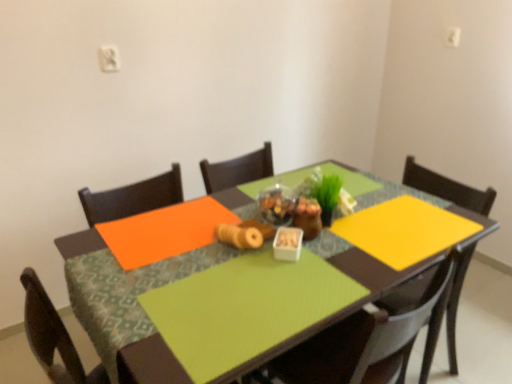
You are a GUI agent. You are given a task and a screenshot of the screen. Output one action in this format:
    pyautogui.click(x=<x>, y=<y>)
    Task: Click on the free location to the right of white matte container at center
    This screenshot has height=384, width=512.
    Given the screenshot: What is the action you would take?
    pyautogui.click(x=342, y=258)